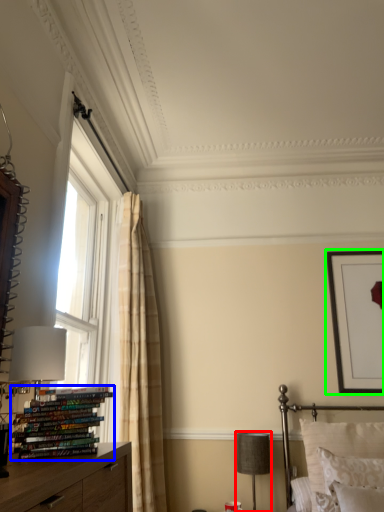
Question: Estimate the real-world distances between objects in this image. Which object is closer to table lamp (highlighted by a red box), book (highlighted by a blue box) or picture frame (highlighted by a green box)?

Choices:
 (A) book
 (B) picture frame

Answer: (B)